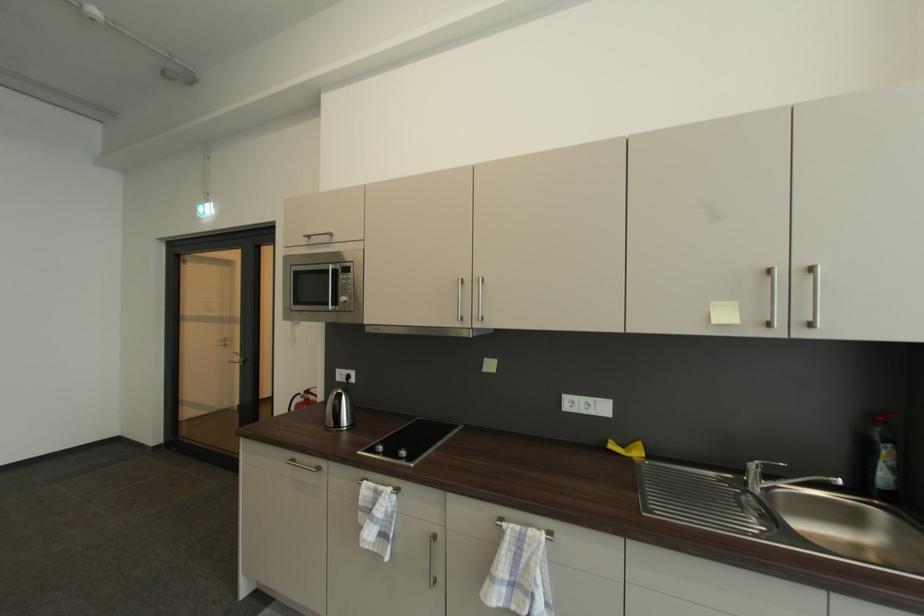
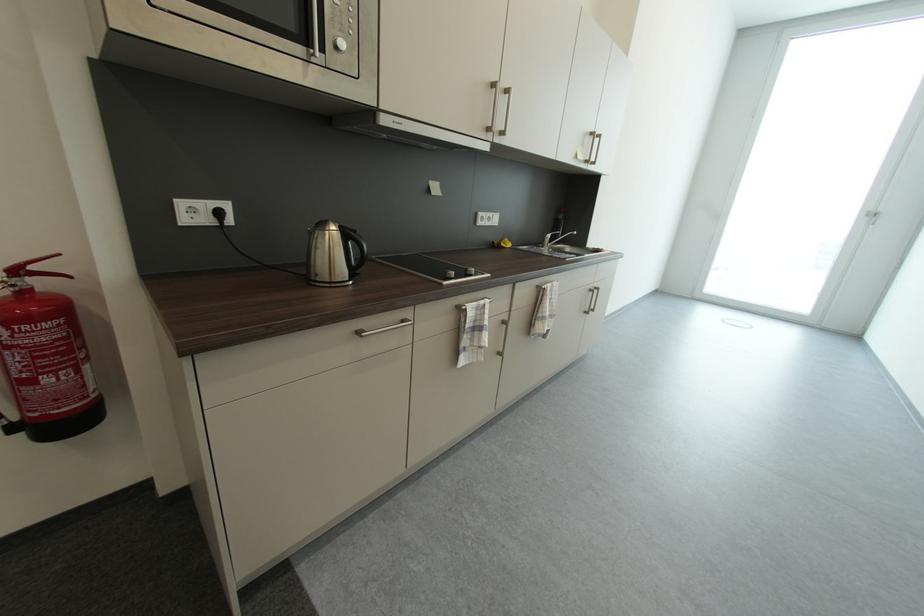
The point at (344, 394) is marked in the first image. Where is the corresponding point in the second image?

(346, 228)